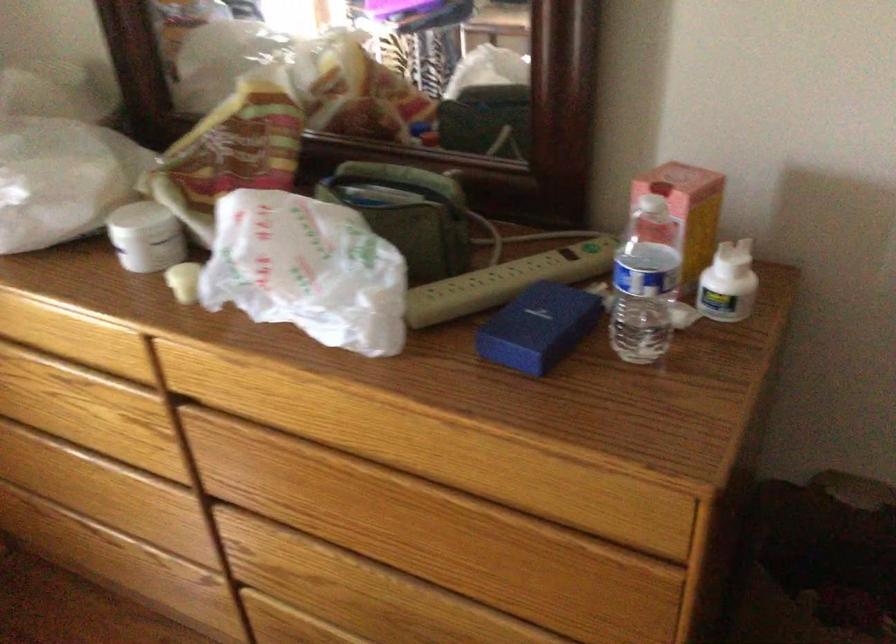
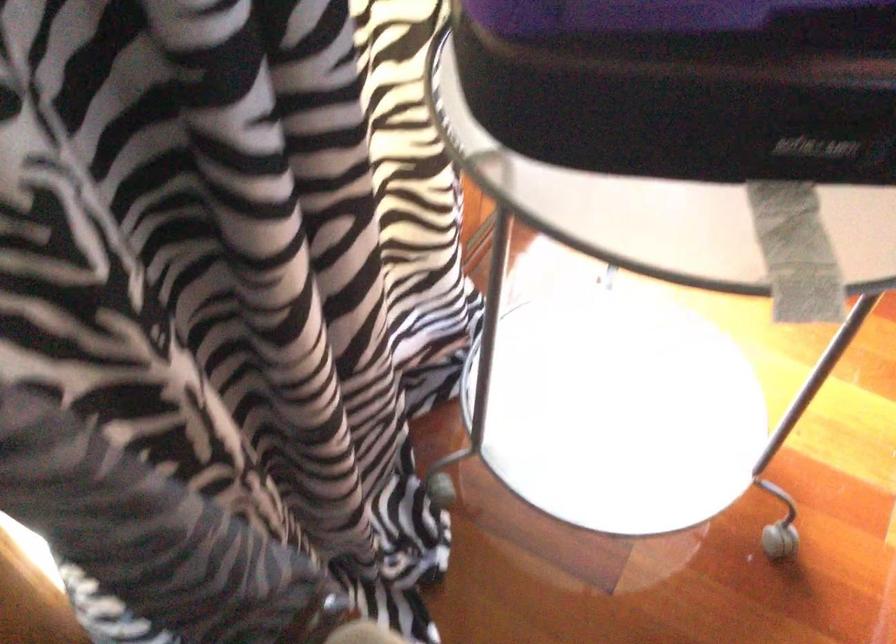
Question: Which direction would the cameraman need to move to produce the second image? Reply with the corresponding letter.

Choices:
 (A) Left
 (B) Right
 (C) Forward
 (D) Backward

Answer: (A)